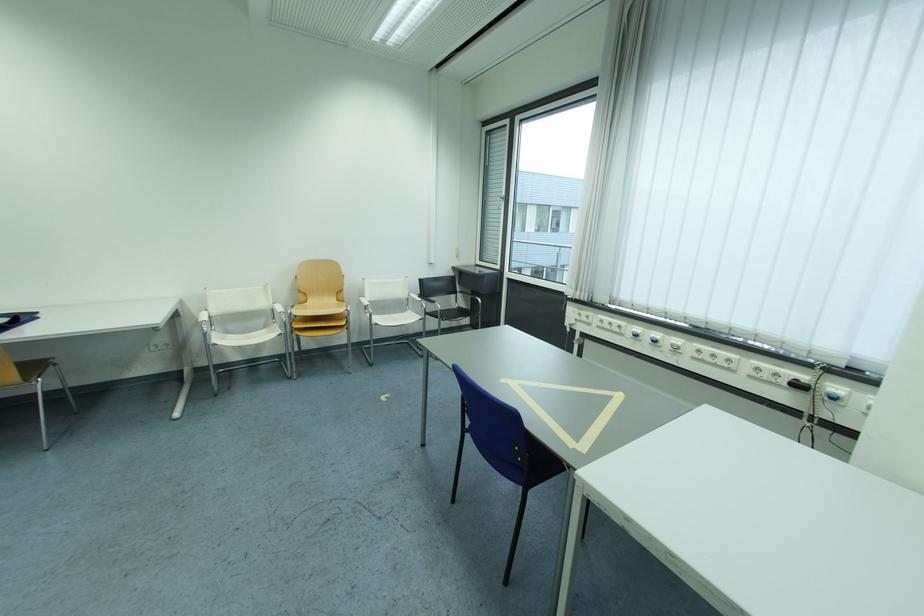
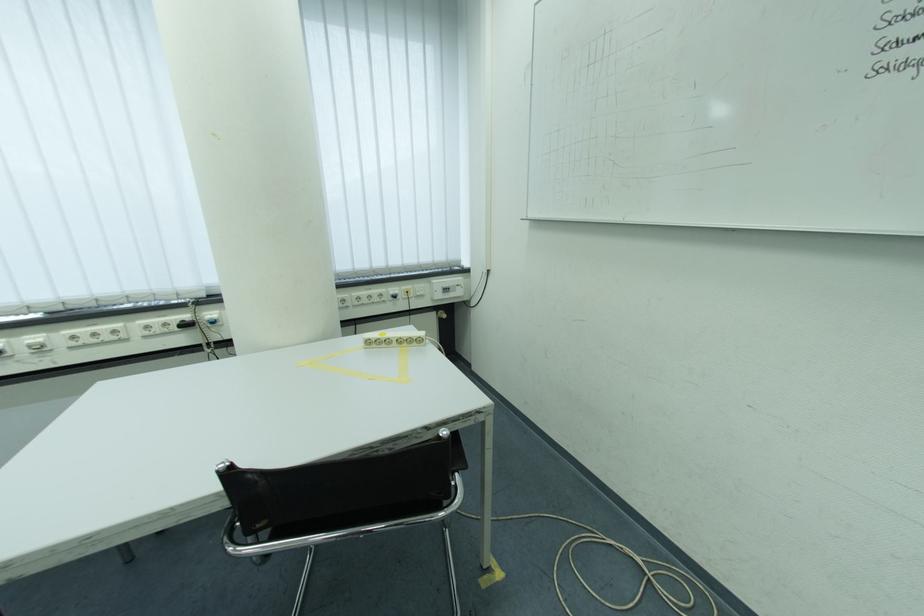
Locate, in the second image, the point that corresponds to (x=785, y=378) in the first image.

(175, 326)